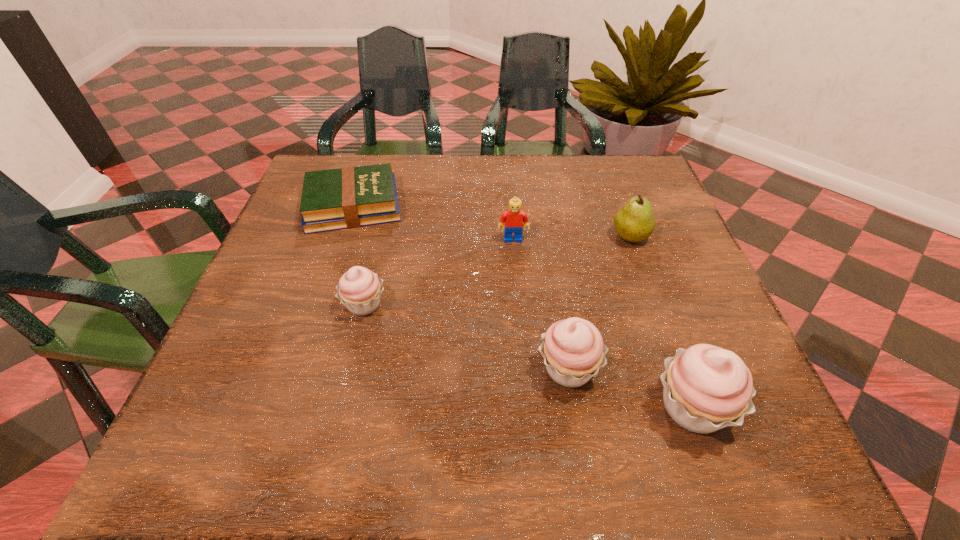
The width and height of the screenshot is (960, 540). What are the coordinates of `vacant space at the far edge of the desktop` in the screenshot? It's located at (501, 203).

Locate an element on the screen. vacant region at the near edge is located at coordinates (637, 371).

The height and width of the screenshot is (540, 960). In the image, there is a desktop. What are the coordinates of `vacant area at the left edge` in the screenshot? It's located at (283, 258).

Identify the location of vacant position at the right edge of the desktop. (615, 248).

Locate an element on the screen. free space at the near left corner of the desktop is located at coordinates (258, 368).

Where is `vacant region at the far right corner of the desktop`? Image resolution: width=960 pixels, height=540 pixels. vacant region at the far right corner of the desktop is located at coordinates (603, 198).

This screenshot has height=540, width=960. I want to click on empty space between the Lego and the third nearest object, so click(439, 272).

What are the coordinates of `free spot between the pear and the second cupcake from right to left` in the screenshot? It's located at (599, 302).

The width and height of the screenshot is (960, 540). I want to click on free space between the second shortest cupcake and the pear, so click(599, 302).

This screenshot has height=540, width=960. Find the location of `unoccupied position between the farthest cupcake and the pear`. unoccupied position between the farthest cupcake and the pear is located at coordinates (497, 271).